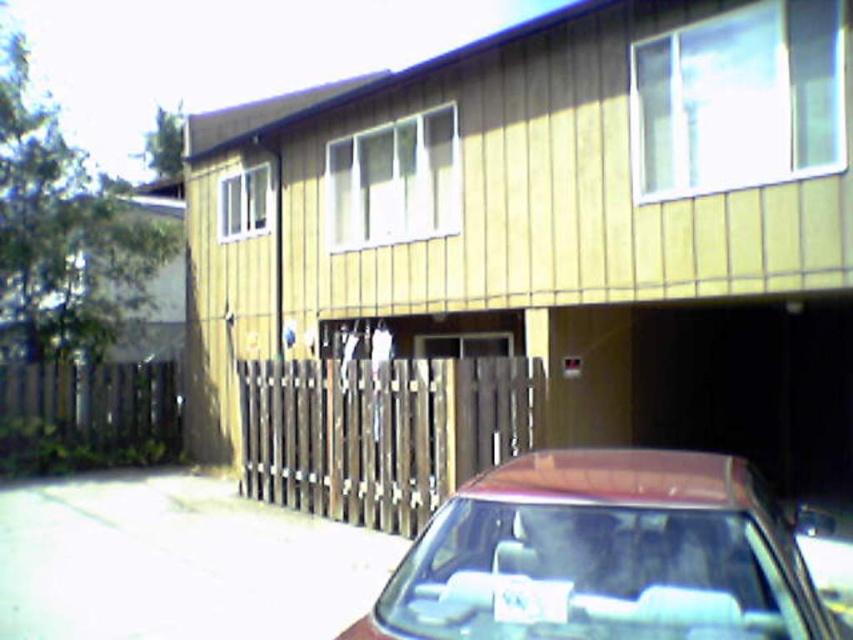
Does shiny maroon sedan at lower center have a lesser height compared to white concrete driveway at lower left?

Incorrect, shiny maroon sedan at lower center's height does not fall short of white concrete driveway at lower left's.

What do you see at coordinates (607, 554) in the screenshot? I see `shiny maroon sedan at lower center` at bounding box center [607, 554].

Is point (456, 580) positioned after point (270, 570)?

No, it is not.

You are a GUI agent. You are given a task and a screenshot of the screen. Output one action in this format:
    pyautogui.click(x=<x>, y=<y>)
    Task: Click on the shiny maroon sedan at lower center
    
    Given the screenshot: What is the action you would take?
    pyautogui.click(x=607, y=554)

Can you confirm if white concrete driveway at lower left is bigger than white plastic license plate at center?

Actually, white concrete driveway at lower left might be smaller than white plastic license plate at center.

Find the location of a particular element. The image size is (853, 640). white concrete driveway at lower left is located at coordinates (177, 563).

Who is higher up, shiny maroon sedan at lower center or white plastic license plate at center?

Positioned higher is shiny maroon sedan at lower center.

Can you confirm if shiny maroon sedan at lower center is shorter than white plastic license plate at center?

In fact, shiny maroon sedan at lower center may be taller than white plastic license plate at center.

Find the location of `shiny maroon sedan at lower center`. shiny maroon sedan at lower center is located at coordinates (607, 554).